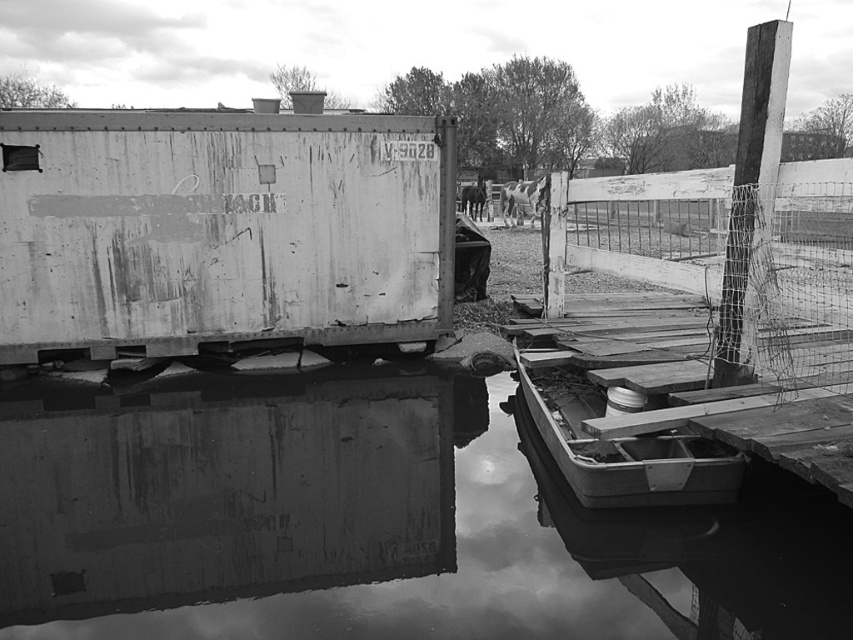
Does rusty metal container at left appear on the right side of wooden boat at lower right?

No, rusty metal container at left is not to the right of wooden boat at lower right.

Between point (450, 227) and point (572, 460), which one is positioned in front?

Point (572, 460) is in front.

Image resolution: width=853 pixels, height=640 pixels. I want to click on rusty metal container at left, so click(221, 234).

Consider the image. Does reflective water at lower center come behind rusty metal container at left?

That is False.

Looking at this image, who is shorter, reflective water at lower center or rusty metal container at left?

rusty metal container at left

Is point (184, 416) closer to viewer compared to point (340, 221)?

Yes, point (184, 416) is closer to viewer.

This screenshot has width=853, height=640. In order to click on reflective water at lower center in this screenshot , I will do `click(370, 525)`.

Can you confirm if reflective water at lower center is bigger than rusty wire mesh fence at right?

Actually, reflective water at lower center might be smaller than rusty wire mesh fence at right.

Can you confirm if reflective water at lower center is taller than rusty wire mesh fence at right?

Incorrect, reflective water at lower center's height is not larger of rusty wire mesh fence at right's.

Is point (720, 557) farther from camera compared to point (668, 253)?

That is False.

Find the location of a particular element. The height and width of the screenshot is (640, 853). reflective water at lower center is located at coordinates (370, 525).